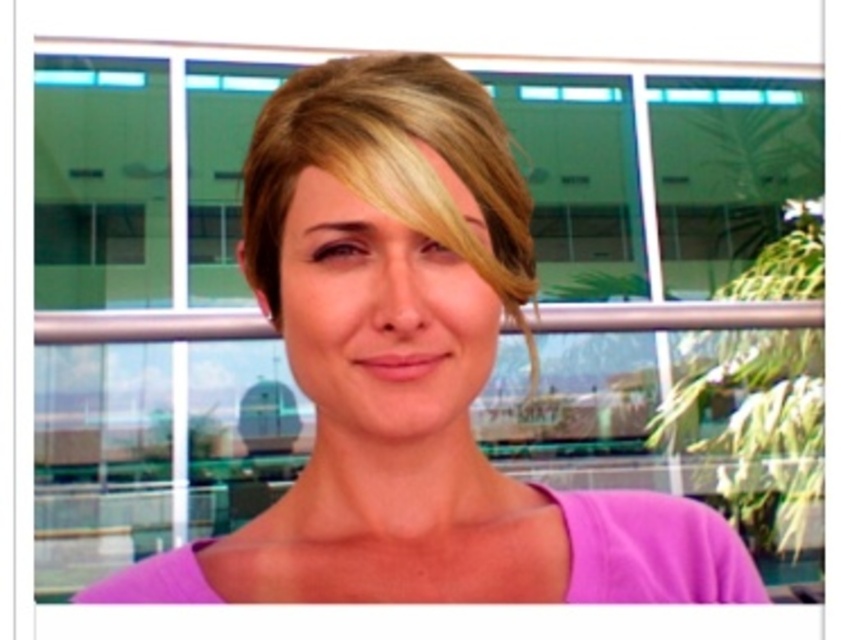
Is purple matte shirt at center below blonde shiny hair at center?

Correct, purple matte shirt at center is located below blonde shiny hair at center.

Does point (340, 260) come closer to viewer compared to point (302, 81)?

Yes, point (340, 260) is closer to viewer.

Image resolution: width=841 pixels, height=640 pixels. Find the location of `purple matte shirt at center`. purple matte shirt at center is located at coordinates (413, 372).